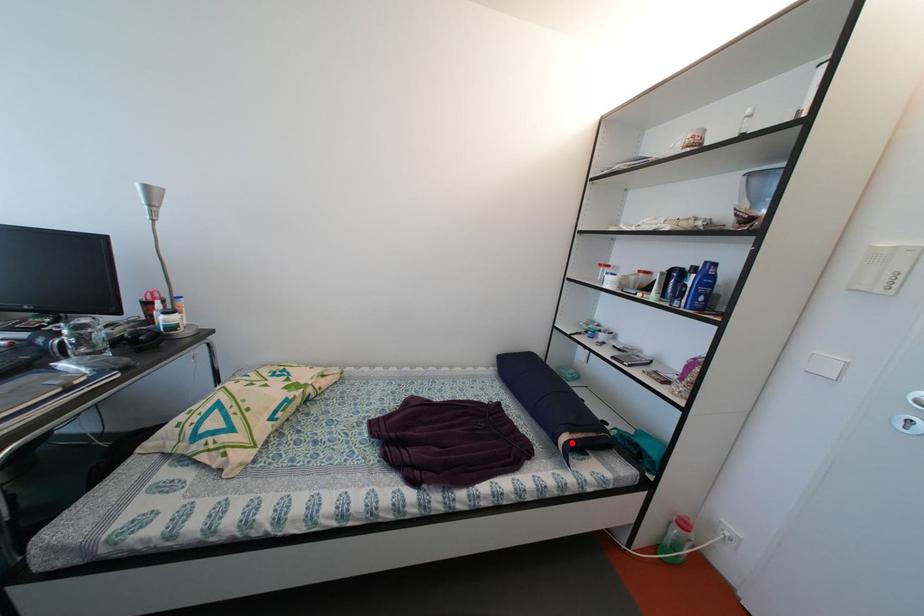
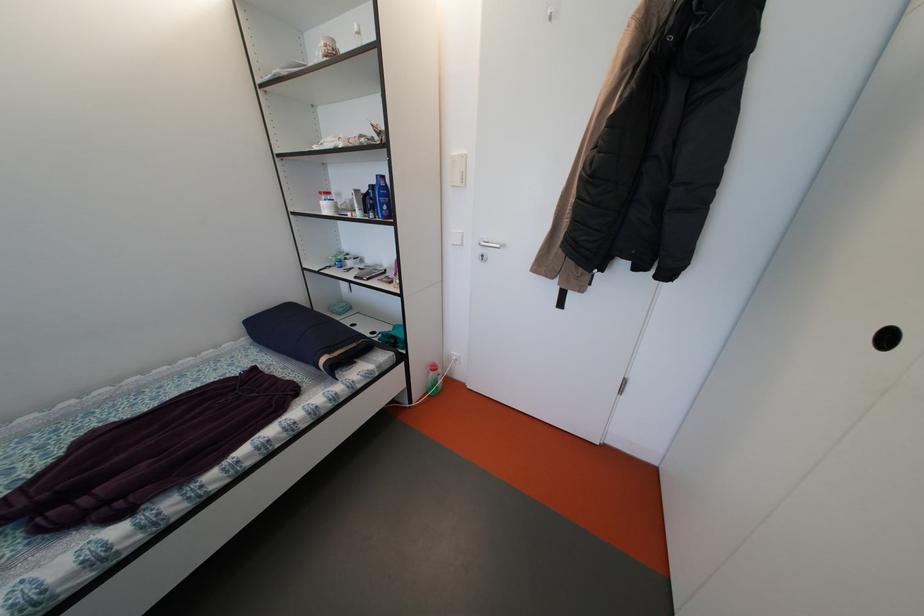
Question: I am providing you with two images of the same scene from different viewpoints. A red point is shown in image1. For the corresponding object point in image2, is it positioned nearer or farther from the camera?

Choices:
 (A) Nearer
 (B) Farther

Answer: (B)